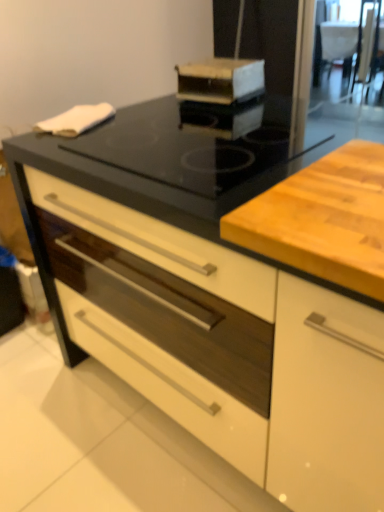
Question: Considering the positions of wooden cutting board at center and black glass gas stove at center in the image, is wooden cutting board at center bigger or smaller than black glass gas stove at center?

Choices:
 (A) big
 (B) small

Answer: (B)

Question: Is point (274, 185) positioned closer to the camera than point (248, 161)?

Choices:
 (A) farther
 (B) closer

Answer: (B)

Question: Which object is the farthest from the wooden cutting board at center?

Choices:
 (A) black glass gas stove at center
 (B) wooden box at upper center
 (C) transparent glass screen door at upper right

Answer: (C)

Question: Considering the real-world distances, which object is farthest from the wooden cutting board at center?

Choices:
 (A) wooden box at upper center
 (B) transparent glass screen door at upper right
 (C) black glass gas stove at center

Answer: (B)